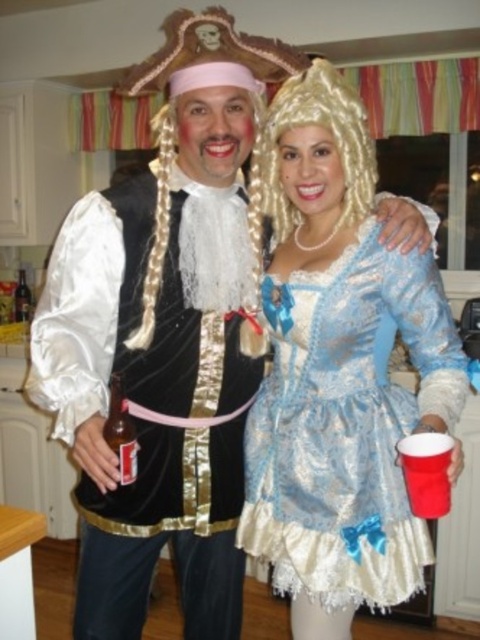
Question: Can you confirm if shiny blue satin dress at center is positioned to the left of blonde synthetic wig at upper center?

Choices:
 (A) yes
 (B) no

Answer: (B)

Question: Which point is farther from the camera taking this photo?

Choices:
 (A) (283, 326)
 (B) (369, 166)

Answer: (A)

Question: Which of the following is the closest to the observer?

Choices:
 (A) blonde synthetic wig at upper center
 (B) shiny blue satin dress at center

Answer: (B)

Question: Is shiny blue satin dress at center positioned before blonde synthetic wig at upper center?

Choices:
 (A) no
 (B) yes

Answer: (B)

Question: Is shiny blue satin dress at center to the left of blonde synthetic wig at upper center from the viewer's perspective?

Choices:
 (A) yes
 (B) no

Answer: (B)